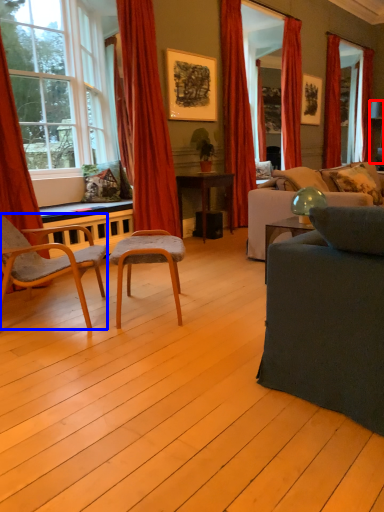
Question: Which object appears closest to the camera in this image, lamp (highlighted by a red box) or chair (highlighted by a blue box)?

Choices:
 (A) lamp
 (B) chair

Answer: (B)